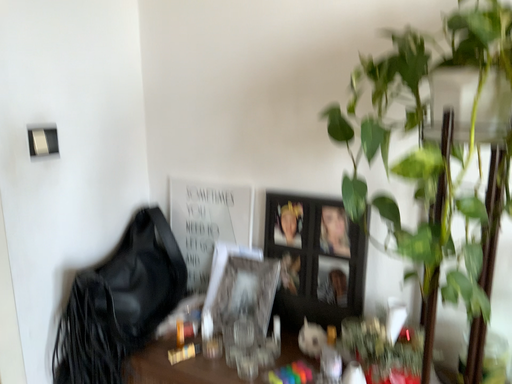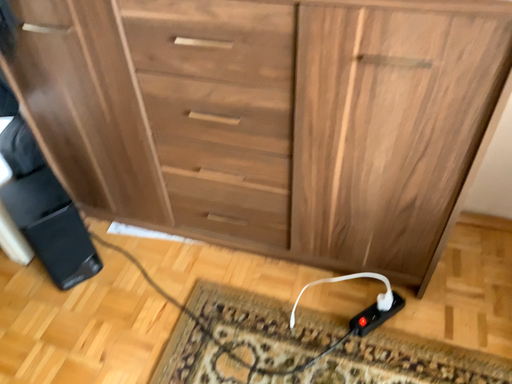
Question: Which way did the camera rotate in the video?

Choices:
 (A) rotated downward
 (B) rotated upward

Answer: (A)